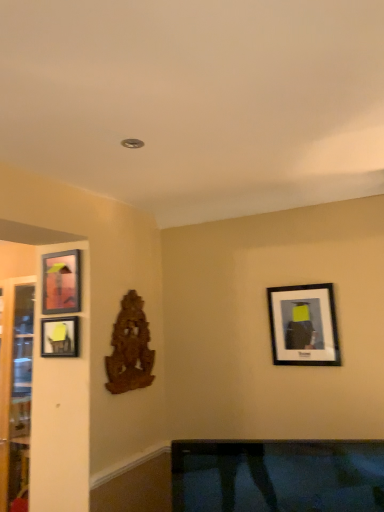
Question: In terms of width, does wooden carving at center-left look wider or thinner when compared to transparent glass door at left?

Choices:
 (A) thin
 (B) wide

Answer: (A)

Question: Is wooden carving at center-left bigger or smaller than transparent glass door at left?

Choices:
 (A) big
 (B) small

Answer: (B)

Question: Based on their relative distances, which object is farther from the transparent glass door at left?

Choices:
 (A) matte black picture frame at upper right, the 3th picture frame viewed from the left
 (B) wooden carving at center-left
 (C) matte black picture frame at left, acting as the 3th picture frame starting from the right
 (D) matte black picture frame at left, arranged as the 2th picture frame when viewed from the right

Answer: (A)

Question: Based on their relative distances, which object is nearer to the transparent glass door at left?

Choices:
 (A) matte black picture frame at upper right, the 3th picture frame viewed from the left
 (B) matte black picture frame at left, arranged as the 2th picture frame when viewed from the right
 (C) matte black picture frame at left, marked as the first picture frame in a left-to-right arrangement
 (D) wooden carving at center-left

Answer: (B)